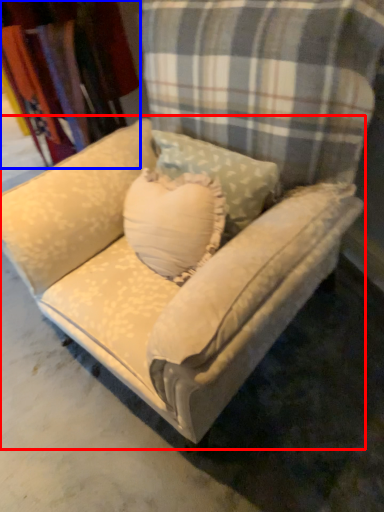
Question: Which point is closer to the camera, studio couch (highlighted by a red box) or fabric (highlighted by a blue box)?

Choices:
 (A) studio couch
 (B) fabric

Answer: (A)